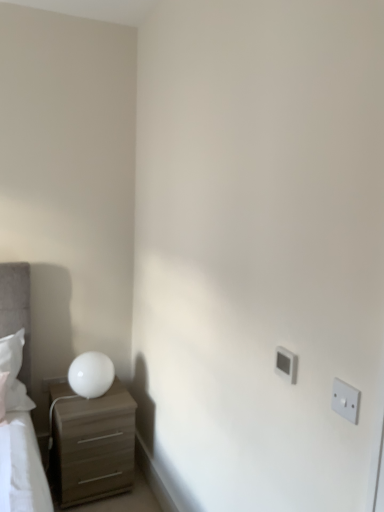
Question: Considering their positions, is white glossy table lamp at left located in front of or behind white plastic electric outlet at right, the first electric outlet when ordered from front to back?

Choices:
 (A) behind
 (B) front

Answer: (A)

Question: Based on their sizes in the image, would you say white glossy table lamp at left is bigger or smaller than white plastic electric outlet at right, the 1th electric outlet when ordered from right to left?

Choices:
 (A) big
 (B) small

Answer: (A)

Question: Which is nearer to the matte brown chest of drawers at lower left?

Choices:
 (A) white glossy table lamp at left
 (B) white plastic electric outlet at upper right, the first electric outlet viewed from the left
 (C) white plastic electric outlet at right, arranged as the second electric outlet when viewed from the left

Answer: (A)

Question: Which of these objects is positioned closest to the matte brown chest of drawers at lower left?

Choices:
 (A) white plastic electric outlet at upper right, the first electric outlet viewed from the left
 (B) white plastic electric outlet at right, acting as the 2th electric outlet starting from the back
 (C) white glossy table lamp at left

Answer: (C)